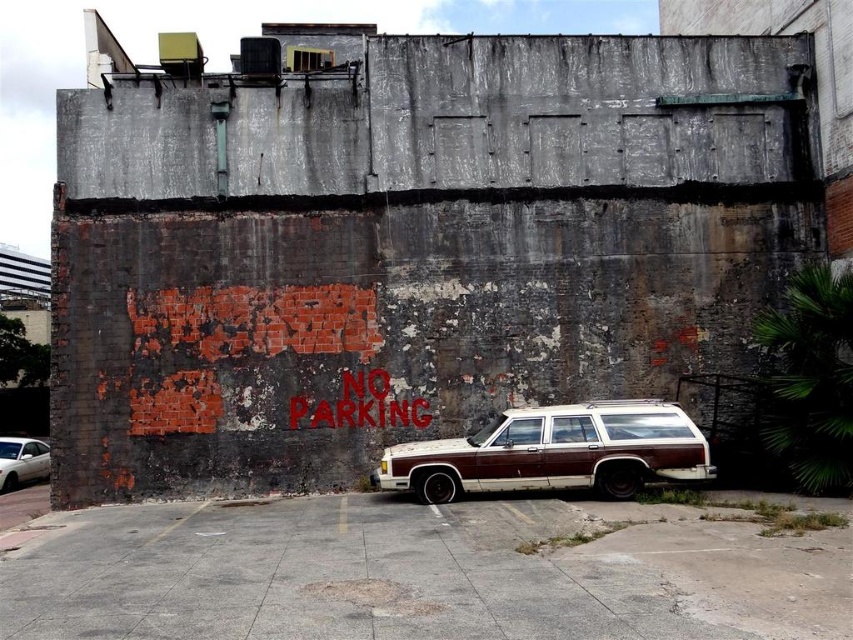
Is point (405, 460) positioned behind point (24, 444)?

No, it is not.

Between point (567, 440) and point (21, 449), which one is positioned behind?

The point (21, 449) is behind.

Is point (456, 476) in front of point (36, 458)?

Yes, it is in front of point (36, 458).

At what (x,y) coordinates should I click in order to perform the action: click on rustic wood station wagon at center. Please return your answer as a coordinate pair (x, y). Looking at the image, I should click on (555, 452).